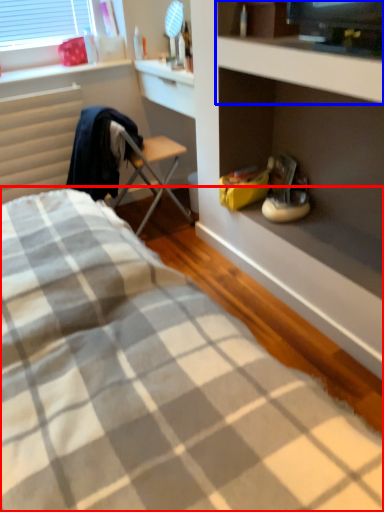
Question: Which object is further to the camera taking this photo, bed (highlighted by a red box) or cabinet (highlighted by a blue box)?

Choices:
 (A) bed
 (B) cabinet

Answer: (B)